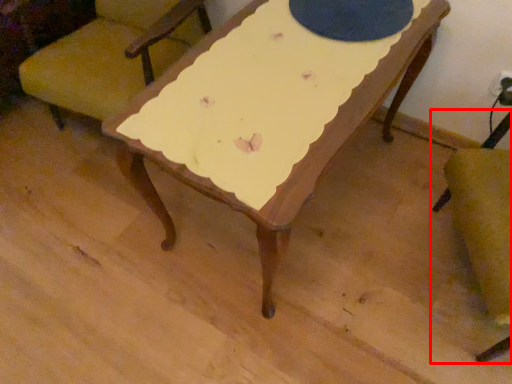
Question: From the image's perspective, where is chair (annotated by the red box) located in relation to chair in the image?

Choices:
 (A) above
 (B) below

Answer: (B)